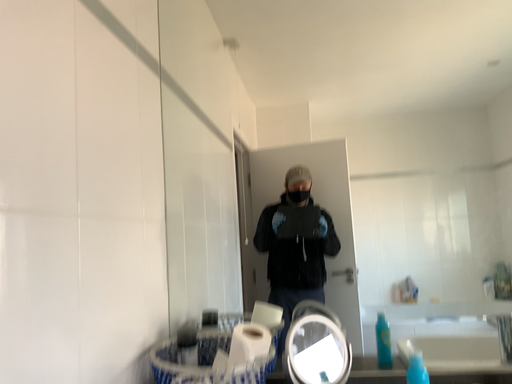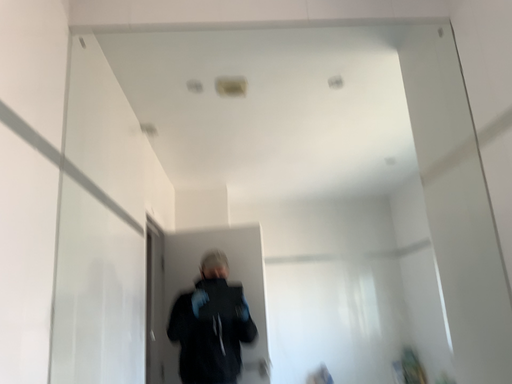
Question: How did the camera likely rotate when shooting the video?

Choices:
 (A) rotated upward
 (B) rotated downward

Answer: (A)